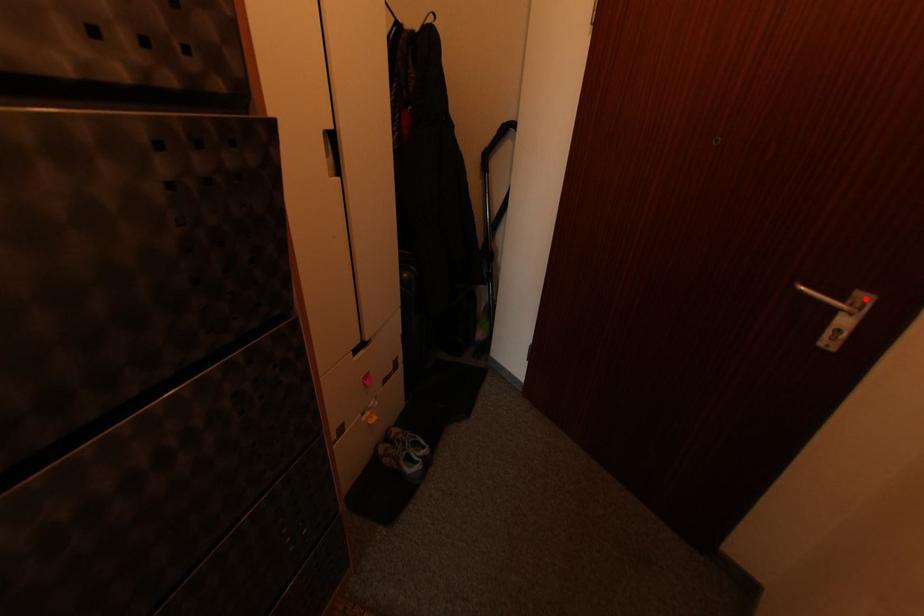
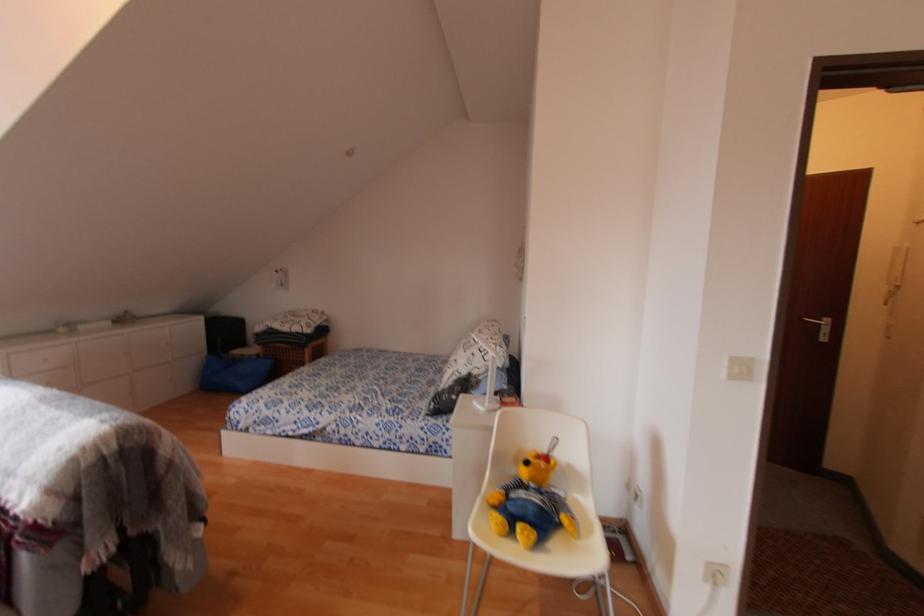
In the second image, find the point that corresponds to the highlighted location in the first image.

(828, 321)